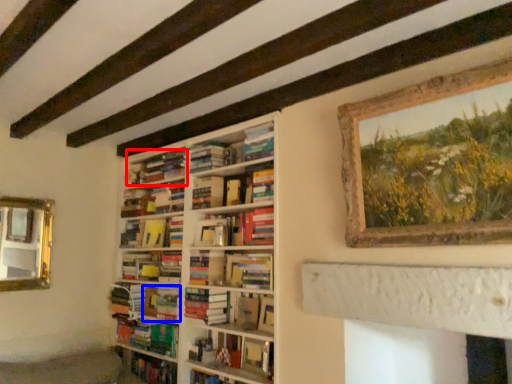
Question: Among these objects, which one is farthest to the camera, book (highlighted by a red box) or book (highlighted by a blue box)?

Choices:
 (A) book
 (B) book

Answer: (B)